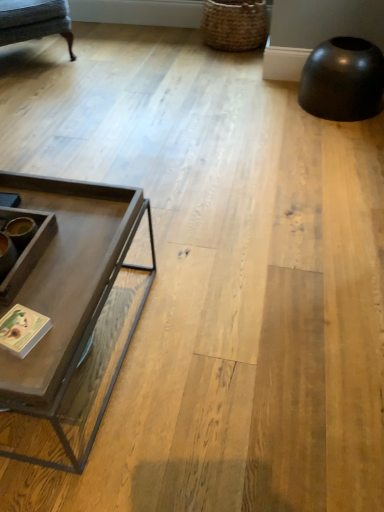
Locate an element on the screen. woven brown basket at upper right is located at coordinates (234, 24).

What is the approximate width of textured gray fabric swivel chair at upper left?

textured gray fabric swivel chair at upper left is 85.55 centimeters in width.

The image size is (384, 512). I want to click on woven brown basket at upper right, so click(234, 24).

In terms of size, does textured gray fabric swivel chair at upper left appear bigger or smaller than matte gray coffee table at left?

Clearly, textured gray fabric swivel chair at upper left is larger in size than matte gray coffee table at left.

In terms of width, does textured gray fabric swivel chair at upper left look wider or thinner when compared to matte gray coffee table at left?

In the image, textured gray fabric swivel chair at upper left appears to be wider than matte gray coffee table at left.

You are a GUI agent. You are given a task and a screenshot of the screen. Output one action in this format:
    pyautogui.click(x=<x>, y=<y>)
    Task: Click on the coffee table on the right of textured gray fabric swivel chair at upper left
    The width and height of the screenshot is (384, 512).
    Given the screenshot: What is the action you would take?
    pyautogui.click(x=72, y=311)

From a real-world perspective, is textured gray fabric swivel chair at upper left under matte gray coffee table at left?

No, from a real-world perspective, textured gray fabric swivel chair at upper left is not beneath matte gray coffee table at left.

Which is correct: woven brown basket at upper right is inside matte gray coffee table at left, or outside of it?

woven brown basket at upper right is located beyond the bounds of matte gray coffee table at left.

Considering the sizes of objects woven brown basket at upper right and matte gray coffee table at left in the image provided, who is bigger, woven brown basket at upper right or matte gray coffee table at left?

matte gray coffee table at left.

In terms of height, does woven brown basket at upper right look taller or shorter compared to matte gray coffee table at left?

In the image, woven brown basket at upper right appears to be shorter than matte gray coffee table at left.

Is woven brown basket at upper right positioned in front of matte gray coffee table at left?

No, woven brown basket at upper right is behind matte gray coffee table at left.

Considering the sizes of textured gray fabric swivel chair at upper left and woven brown basket at upper right in the image, is textured gray fabric swivel chair at upper left wider or thinner than woven brown basket at upper right?

Clearly, textured gray fabric swivel chair at upper left has more width compared to woven brown basket at upper right.

Considering the relative sizes of textured gray fabric swivel chair at upper left and woven brown basket at upper right in the image provided, is textured gray fabric swivel chair at upper left shorter than woven brown basket at upper right?

Incorrect, the height of textured gray fabric swivel chair at upper left does not fall short of that of woven brown basket at upper right.

How far apart are textured gray fabric swivel chair at upper left and woven brown basket at upper right?

A distance of 4.21 feet exists between textured gray fabric swivel chair at upper left and woven brown basket at upper right.

Is point (32, 22) closer to camera compared to point (257, 32)?

Yes, point (32, 22) is in front of point (257, 32).

Does point (37, 256) appear closer or farther from the camera than point (235, 9)?

Clearly, point (37, 256) is closer to the camera than point (235, 9).

Is matte gray coffee table at left looking in the opposite direction of woven brown basket at upper right?

No, woven brown basket at upper right is not at the back of matte gray coffee table at left.

Is the surface of matte gray coffee table at left in direct contact with woven brown basket at upper right?

No, matte gray coffee table at left is not next to woven brown basket at upper right.

In the image, is matte gray coffee table at left positioned in front of or behind woven brown basket at upper right?

matte gray coffee table at left is positioned closer to the viewer than woven brown basket at upper right.

You are a GUI agent. You are given a task and a screenshot of the screen. Output one action in this format:
    pyautogui.click(x=<x>, y=<y>)
    Task: Click on the coffee table that is under the textured gray fabric swivel chair at upper left (from a real-world perspective)
    
    Given the screenshot: What is the action you would take?
    pyautogui.click(x=72, y=311)

Would you say matte gray coffee table at left is to the left or to the right of textured gray fabric swivel chair at upper left in the picture?

From the image, it's evident that matte gray coffee table at left is to the right of textured gray fabric swivel chair at upper left.

From a real-world perspective, is matte gray coffee table at left on top of textured gray fabric swivel chair at upper left?

Actually, matte gray coffee table at left is physically below textured gray fabric swivel chair at upper left in the real world.

Considering the relative sizes of matte gray coffee table at left and textured gray fabric swivel chair at upper left in the image provided, is matte gray coffee table at left smaller than textured gray fabric swivel chair at upper left?

Correct, matte gray coffee table at left occupies less space than textured gray fabric swivel chair at upper left.

From a real-world perspective, who is located lower, woven brown basket at upper right or textured gray fabric swivel chair at upper left?

woven brown basket at upper right, from a real-world perspective.

From the image's perspective, which is above, woven brown basket at upper right or textured gray fabric swivel chair at upper left?

woven brown basket at upper right.

Based on their positions, is woven brown basket at upper right located to the left or right of textured gray fabric swivel chair at upper left?

Based on their positions, woven brown basket at upper right is located to the right of textured gray fabric swivel chair at upper left.

How many degrees apart are the facing directions of woven brown basket at upper right and textured gray fabric swivel chair at upper left?

48.4 degrees.

Find the location of a particular element. This screenshot has height=512, width=384. coffee table on the right of the textured gray fabric swivel chair at upper left is located at coordinates (72, 311).

In the image, there is a woven brown basket at upper right. Where is `coffee table below it (from the image's perspective)`? Image resolution: width=384 pixels, height=512 pixels. coffee table below it (from the image's perspective) is located at coordinates (72, 311).

From the image, which object appears to be farther from textured gray fabric swivel chair at upper left, matte gray coffee table at left or woven brown basket at upper right?

Among the two, matte gray coffee table at left is located further to textured gray fabric swivel chair at upper left.

Estimate the real-world distances between objects in this image. Which object is further from matte gray coffee table at left, woven brown basket at upper right or textured gray fabric swivel chair at upper left?

Among the two, woven brown basket at upper right is located further to matte gray coffee table at left.

From the image, which object appears to be farther from woven brown basket at upper right, matte gray coffee table at left or textured gray fabric swivel chair at upper left?

matte gray coffee table at left lies further to woven brown basket at upper right than the other object.

Looking at this image, estimate the real-world distances between objects in this image. Which object is closer to textured gray fabric swivel chair at upper left, woven brown basket at upper right or matte gray coffee table at left?

Among the two, woven brown basket at upper right is located nearer to textured gray fabric swivel chair at upper left.

From the image, which object appears to be nearer to matte gray coffee table at left, textured gray fabric swivel chair at upper left or woven brown basket at upper right?

Among the two, textured gray fabric swivel chair at upper left is located nearer to matte gray coffee table at left.

Looking at the image, which one is located closer to woven brown basket at upper right, textured gray fabric swivel chair at upper left or matte gray coffee table at left?

Based on the image, textured gray fabric swivel chair at upper left appears to be nearer to woven brown basket at upper right.

You are a GUI agent. You are given a task and a screenshot of the screen. Output one action in this format:
    pyautogui.click(x=<x>, y=<y>)
    Task: Click on the swivel chair between matte gray coffee table at left and woven brown basket at upper right in the front-back direction
    
    Given the screenshot: What is the action you would take?
    (x=34, y=21)